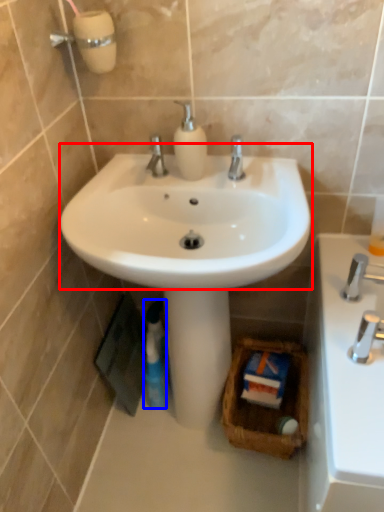
Question: Which object appears farthest to the camera in this image, sink (highlighted by a red box) or mouthwash (highlighted by a blue box)?

Choices:
 (A) sink
 (B) mouthwash

Answer: (B)